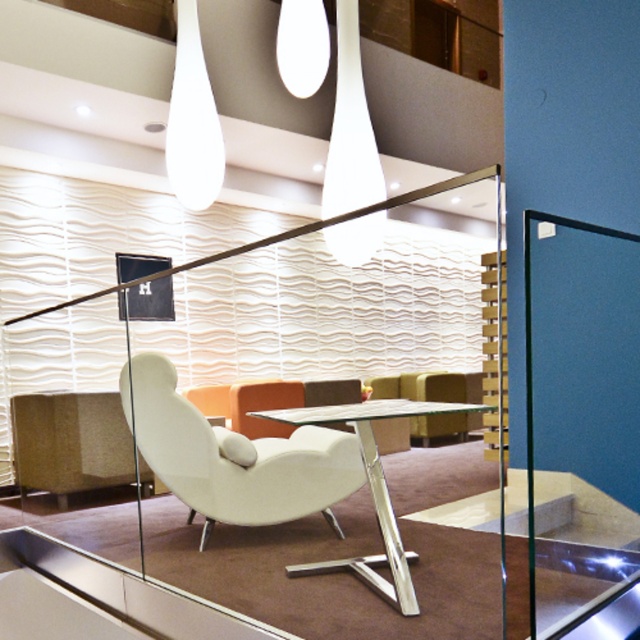
Between transparent glass door at right and white glossy lamp at upper center, which one appears on the left side from the viewer's perspective?

Positioned to the left is white glossy lamp at upper center.

Which is behind, point (538, 433) or point (344, 156)?

The point (344, 156) is behind.

This screenshot has width=640, height=640. I want to click on transparent glass door at right, so click(582, 422).

Who is positioned more to the right, transparent glass door at right or transparent glass table at center?

From the viewer's perspective, transparent glass door at right appears more on the right side.

Does transparent glass door at right have a larger size compared to transparent glass table at center?

Yes, transparent glass door at right is bigger than transparent glass table at center.

What are the coordinates of `transparent glass door at right` in the screenshot? It's located at 582,422.

In the scene shown: Can you confirm if white matte swivel chair at center is wider than white glossy lamp at upper center?

Yes, white matte swivel chair at center is wider than white glossy lamp at upper center.

Who is more forward, [330,436] or [369,182]?

Positioned in front is point [330,436].

From the picture: Who is more forward, (177, 426) or (362, 248)?

Point (177, 426) is more forward.

Find the location of a particular element. This screenshot has width=640, height=640. white matte swivel chair at center is located at coordinates (234, 456).